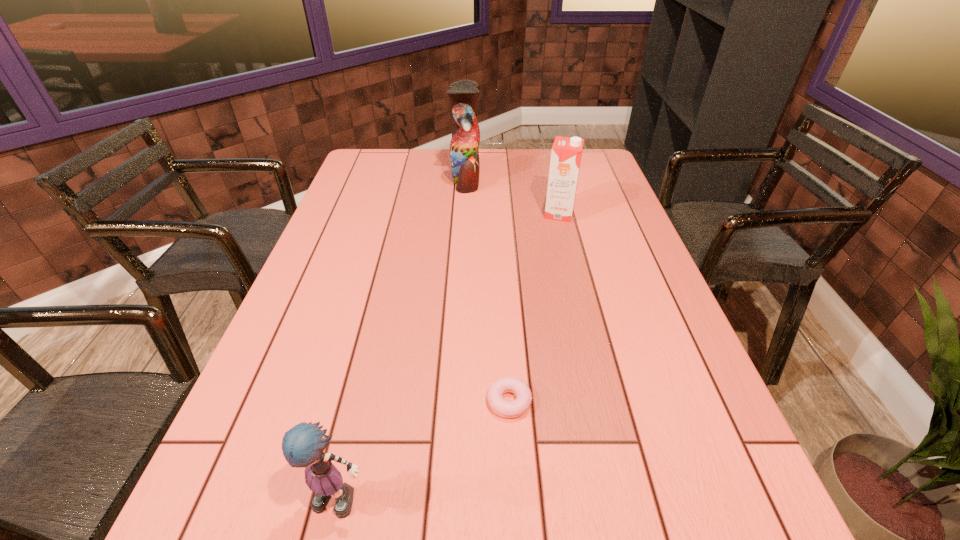
Where is `free location located 0.350m on the right of the doughnut`? The height and width of the screenshot is (540, 960). free location located 0.350m on the right of the doughnut is located at coordinates (708, 401).

I want to click on object that is positioned at the far edge, so click(x=464, y=154).

You are a GUI agent. You are given a task and a screenshot of the screen. Output one action in this format:
    pyautogui.click(x=<x>, y=<y>)
    Task: Click on the object at the near edge
    
    Given the screenshot: What is the action you would take?
    pyautogui.click(x=303, y=445)

What are the coordinates of `blank space at the left edge of the desktop` in the screenshot? It's located at (360, 211).

In order to click on free location at the right edge in this screenshot , I will do `click(602, 286)`.

I want to click on vacant position at the far left corner of the desktop, so click(365, 169).

I want to click on blank space at the far right corner, so click(x=599, y=172).

What are the coordinates of `blank region between the leftmost object and the shortest object` in the screenshot? It's located at (426, 450).

The width and height of the screenshot is (960, 540). I want to click on free area in between the third nearest object and the third farthest object, so click(534, 307).

Where is `free space between the rightmost object and the shortest object`? The width and height of the screenshot is (960, 540). free space between the rightmost object and the shortest object is located at coordinates (534, 307).